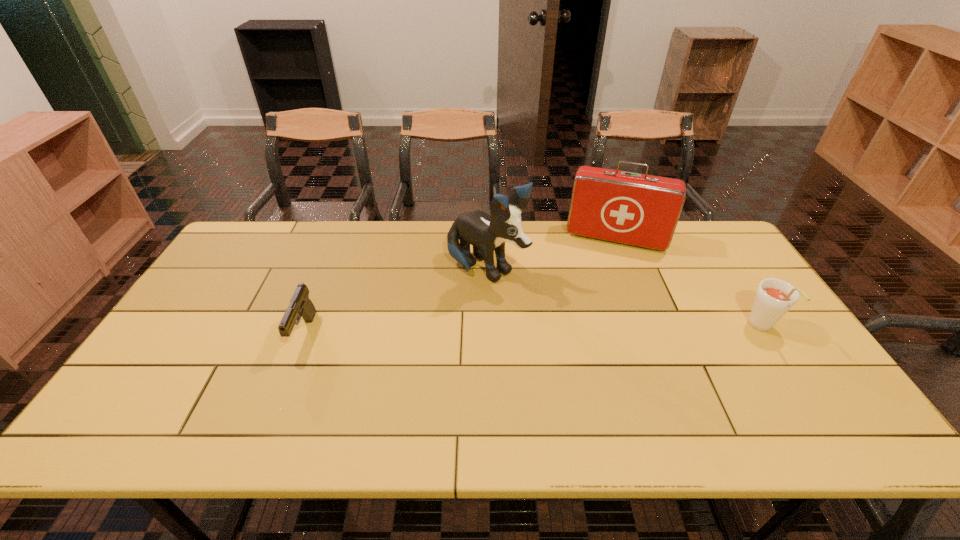
The height and width of the screenshot is (540, 960). Identify the location of the leftmost object. (300, 305).

I want to click on pistol, so click(x=300, y=305).

Find the location of a particular element. the third tallest object is located at coordinates (774, 298).

Where is `root beer`? Image resolution: width=960 pixels, height=540 pixels. root beer is located at coordinates (774, 298).

The width and height of the screenshot is (960, 540). Find the location of `the tallest object`. the tallest object is located at coordinates (487, 234).

At what (x,y) coordinates should I click in order to perform the action: click on the third object from right to left. Please return your answer as a coordinate pair (x, y). This screenshot has width=960, height=540. Looking at the image, I should click on (487, 234).

Where is `the second object from right to left`? Image resolution: width=960 pixels, height=540 pixels. the second object from right to left is located at coordinates (642, 210).

Where is `the first-aid kit`? This screenshot has height=540, width=960. the first-aid kit is located at coordinates (642, 210).

Where is `vacant space located 0.120m aim along the barrel of the shortest object`? vacant space located 0.120m aim along the barrel of the shortest object is located at coordinates (278, 399).

The width and height of the screenshot is (960, 540). What are the coordinates of `free space located on the drink side of the second shortest object` in the screenshot? It's located at (804, 394).